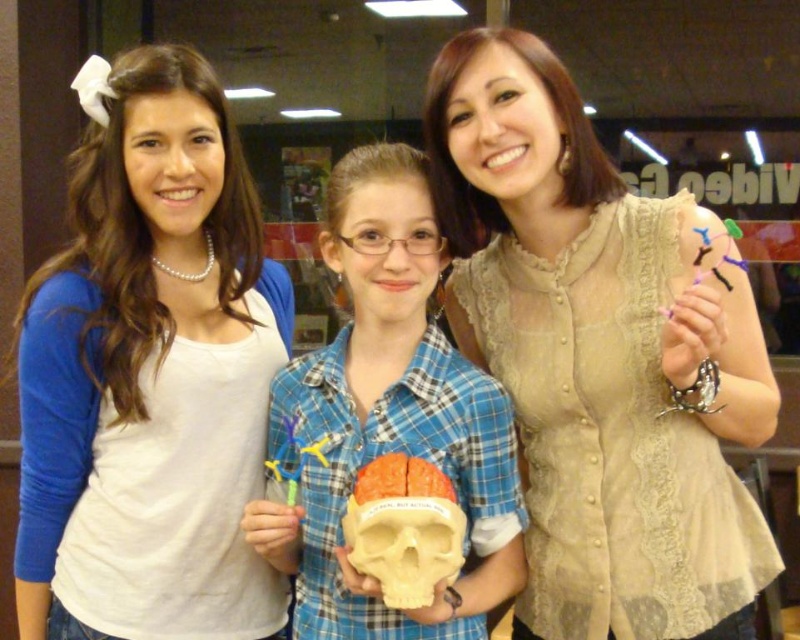
Consider the image. Does beige lace blouse at center have a lesser width compared to matte plastic skull at center?

Incorrect, beige lace blouse at center's width is not less than matte plastic skull at center's.

Describe the element at coordinates (600, 356) in the screenshot. Image resolution: width=800 pixels, height=640 pixels. I see `beige lace blouse at center` at that location.

The image size is (800, 640). Find the location of `beige lace blouse at center`. beige lace blouse at center is located at coordinates (600, 356).

Does beige lace blouse at center appear over white pearl necklace at upper left?

Indeed, beige lace blouse at center is positioned over white pearl necklace at upper left.

Is beige lace blouse at center positioned behind white pearl necklace at upper left?

No, beige lace blouse at center is in front of white pearl necklace at upper left.

At what (x,y) coordinates should I click in order to perform the action: click on beige lace blouse at center. Please return your answer as a coordinate pair (x, y). Looking at the image, I should click on coord(600,356).

You are a GUI agent. You are given a task and a screenshot of the screen. Output one action in this format:
    pyautogui.click(x=<x>, y=<y>)
    Task: Click on the beige lace blouse at center
    The width and height of the screenshot is (800, 640).
    Given the screenshot: What is the action you would take?
    pyautogui.click(x=600, y=356)

Who is more forward, (136, 614) or (434, 520)?

Point (434, 520)

Who is positioned more to the left, white pearl necklace at upper left or orange matte skull at center?

white pearl necklace at upper left

Which is behind, point (152, 74) or point (348, 552)?

The point (152, 74) is more distant.

Identify the location of white pearl necklace at upper left. (145, 362).